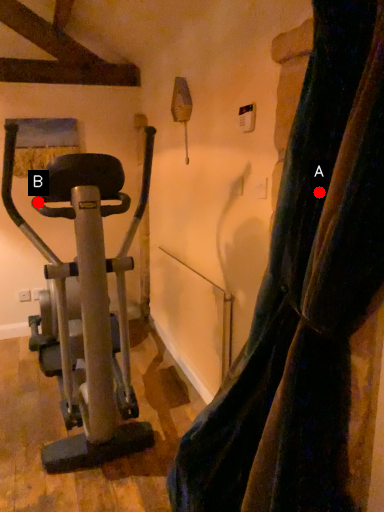
Question: Two points are circled on the image, labeled by A and B beside each circle. Which point is further to the camera?

Choices:
 (A) A is further
 (B) B is further

Answer: (B)